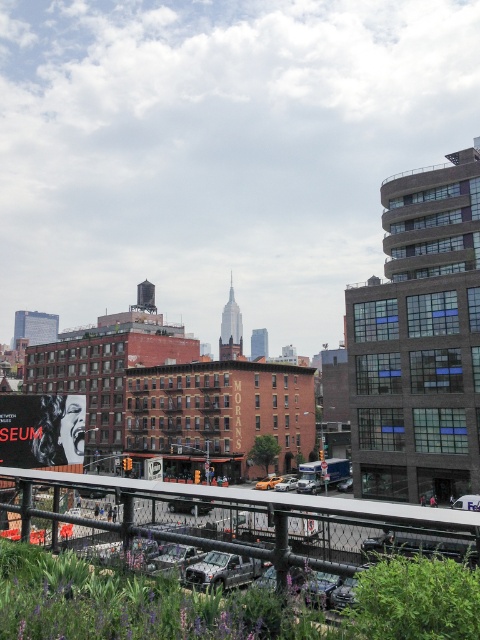
Is black metal railing at lower center to the right of matte black poster at lower left from the viewer's perspective?

Indeed, black metal railing at lower center is positioned on the right side of matte black poster at lower left.

From the picture: Does black metal railing at lower center have a smaller size compared to matte black poster at lower left?

No.

Is point (279, 580) less distant than point (24, 452)?

Yes, it is in front of point (24, 452).

The image size is (480, 640). What are the coordinates of `black metal railing at lower center` in the screenshot? It's located at (260, 518).